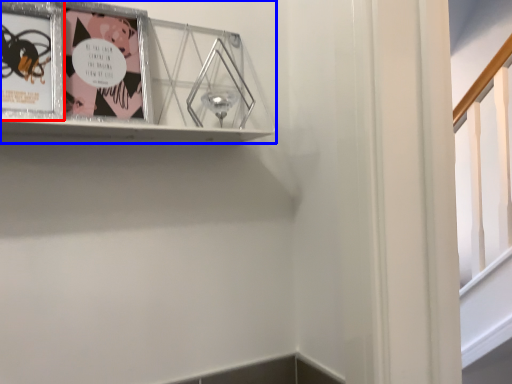
Question: Which point is further to the camera, picture frame (highlighted by a red box) or picture frame (highlighted by a blue box)?

Choices:
 (A) picture frame
 (B) picture frame

Answer: (A)